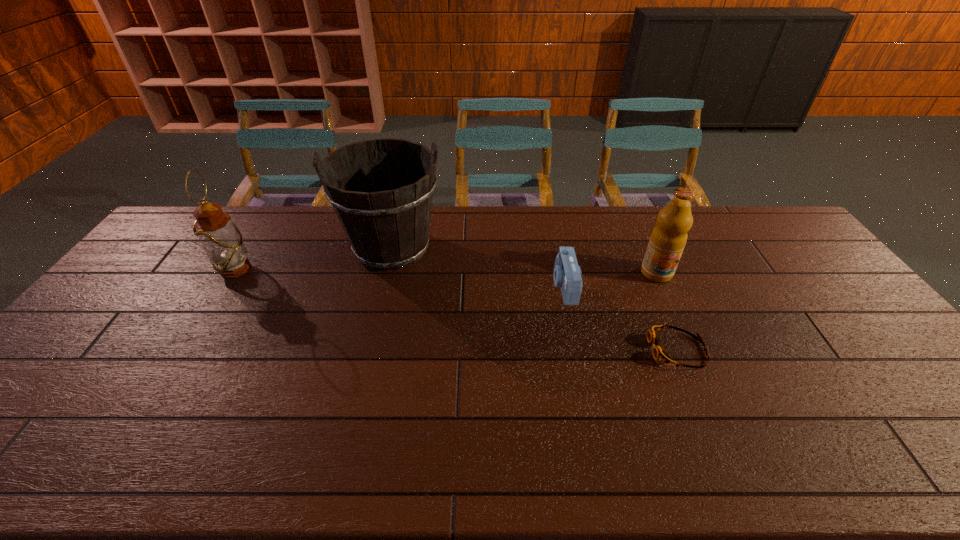
At what (x,y) coordinates should I click in order to perform the action: click on free spot between the fruit juice and the goggles. Please return your answer as a coordinate pair (x, y). Looking at the image, I should click on pyautogui.click(x=667, y=312).

The image size is (960, 540). Identify the location of empty space between the third object from right to left and the oil lamp. (400, 277).

Choose which object is the third nearest neighbor to the third tallest object. Please provide its 2D coordinates. Your answer should be formatted as a tuple, i.e. [(x, y)], where the tuple contains the x and y coordinates of a point satisfying the conditions above.

[(387, 225)]

Where is `the third closest object to the second object from left to right`? This screenshot has width=960, height=540. the third closest object to the second object from left to right is located at coordinates (659, 353).

This screenshot has width=960, height=540. I want to click on vacant area in the image that satisfies the following two spatial constraints: 1. on the front label of the third shortest object; 2. on the lens of the third object from left to right, so click(662, 286).

Find the location of a particular element. The height and width of the screenshot is (540, 960). free spot that satisfies the following two spatial constraints: 1. on the front label of the fruit juice; 2. with the lenses facing forward on the shortest object is located at coordinates (691, 350).

Locate an element on the screen. free space that satisfies the following two spatial constraints: 1. on the front label of the fruit juice; 2. on the lens of the camera is located at coordinates (662, 286).